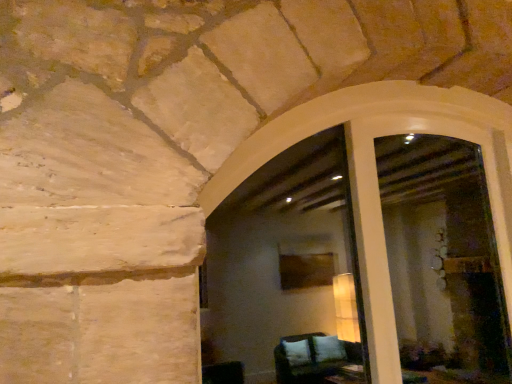
Identify the location of white glossy screen door at center. (383, 228).

What do you see at coordinates (383, 228) in the screenshot? This screenshot has height=384, width=512. I see `white glossy screen door at center` at bounding box center [383, 228].

Image resolution: width=512 pixels, height=384 pixels. Describe the element at coordinates (377, 177) in the screenshot. I see `white smooth window frame at center` at that location.

The height and width of the screenshot is (384, 512). I want to click on white smooth window frame at center, so click(x=377, y=177).

In order to face white smooth window frame at center, should I rotate leftwards or rightwards?

You should rotate right by 18.334 degrees.

Find the location of a particular element. white glossy screen door at center is located at coordinates (383, 228).

Considering the relative positions of white glossy screen door at center and white smooth window frame at center in the image provided, is white glossy screen door at center to the right of white smooth window frame at center from the viewer's perspective?

Yes, white glossy screen door at center is to the right of white smooth window frame at center.

Which object is closer to the camera, white glossy screen door at center or white smooth window frame at center?

white smooth window frame at center.

Does point (496, 149) come behind point (503, 234)?

Yes.

From the image's perspective, is white glossy screen door at center over white smooth window frame at center?

Yes, from the image's perspective, white glossy screen door at center is above white smooth window frame at center.

From a real-world perspective, is white glossy screen door at center on top of white smooth window frame at center?

Indeed, from a real-world perspective, white glossy screen door at center stands above white smooth window frame at center.

Is white glossy screen door at center wider or thinner than white smooth window frame at center?

In the image, white glossy screen door at center appears to be more narrow than white smooth window frame at center.

Who is taller, white glossy screen door at center or white smooth window frame at center?

white glossy screen door at center.

Does white glossy screen door at center have a smaller size compared to white smooth window frame at center?

Indeed, white glossy screen door at center has a smaller size compared to white smooth window frame at center.

Is white glossy screen door at center outside of white smooth window frame at center?

No, white glossy screen door at center is inside white smooth window frame at center's boundary.

Is white glossy screen door at center with white smooth window frame at center?

Indeed, white glossy screen door at center and white smooth window frame at center are beside each other and touching.

Is white glossy screen door at center facing towards white smooth window frame at center?

Yes, white glossy screen door at center is turned towards white smooth window frame at center.

Can you tell me how much white glossy screen door at center and white smooth window frame at center differ in facing direction?

There is a 0.00168-degree angle between the facing directions of white glossy screen door at center and white smooth window frame at center.

Identify the location of screen door that appears above the white smooth window frame at center (from the image's perspective). Image resolution: width=512 pixels, height=384 pixels. (383, 228).

Is white smooth window frame at center to the left or to the right of white glossy screen door at center in the image?

In the image, white smooth window frame at center appears on the left side of white glossy screen door at center.

Which object is more forward, white smooth window frame at center or white glossy screen door at center?

white smooth window frame at center is in front.

Is point (466, 123) behind point (364, 208)?

Yes, point (466, 123) is behind point (364, 208).

From the image's perspective, between white smooth window frame at center and white glossy screen door at center, who is located below?

white smooth window frame at center, from the image's perspective.

From a real-world perspective, is white smooth window frame at center physically below white glossy screen door at center?

Yes.

Between white smooth window frame at center and white glossy screen door at center, which one has larger width?

white smooth window frame at center.

From their relative heights in the image, would you say white smooth window frame at center is taller or shorter than white glossy screen door at center?

Clearly, white smooth window frame at center is shorter compared to white glossy screen door at center.

Can you confirm if white smooth window frame at center is smaller than white glossy screen door at center?

No, white smooth window frame at center is not smaller than white glossy screen door at center.

Is white smooth window frame at center located outside white glossy screen door at center?

That's incorrect, white smooth window frame at center is not completely outside white glossy screen door at center.

Is there a large distance between white smooth window frame at center and white glossy screen door at center?

They are positioned close to each other.

Is white smooth window frame at center positioned with its back to white glossy screen door at center?

Yes, white smooth window frame at center is positioned with its back facing white glossy screen door at center.

Locate an element on the screen. This screenshot has height=384, width=512. window frame in front of the white glossy screen door at center is located at coordinates (377, 177).

This screenshot has height=384, width=512. I want to click on screen door that is above the white smooth window frame at center (from the image's perspective), so click(383, 228).

This screenshot has width=512, height=384. What are the coordinates of `window frame in front of the white glossy screen door at center` in the screenshot? It's located at (377, 177).